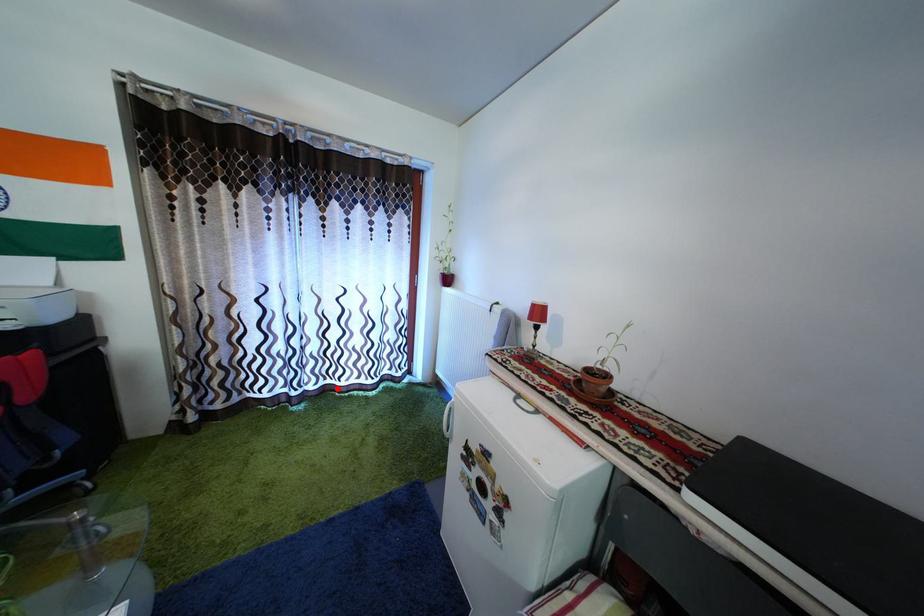
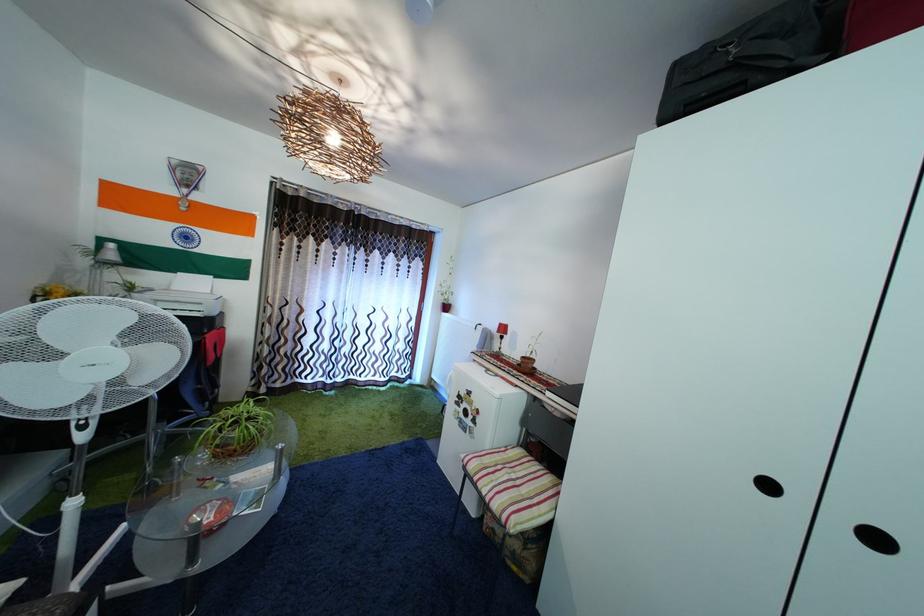
Question: I am providing you with two images of the same scene from different viewpoints. Image1 has a red point marked. In image2, the corresponding 3D location appears at what relative position? Reply with the corresponding letter.

Choices:
 (A) Closer
 (B) Farther

Answer: (B)